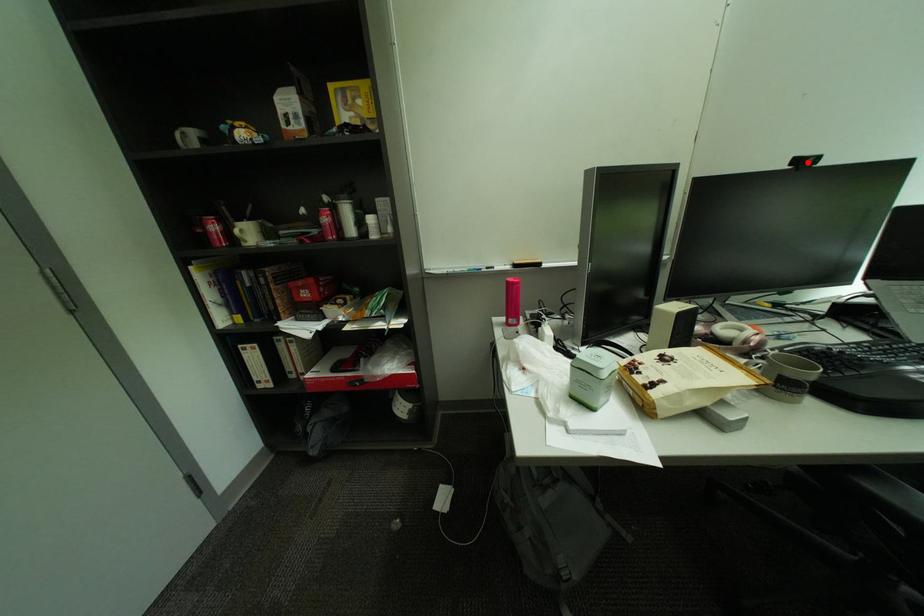
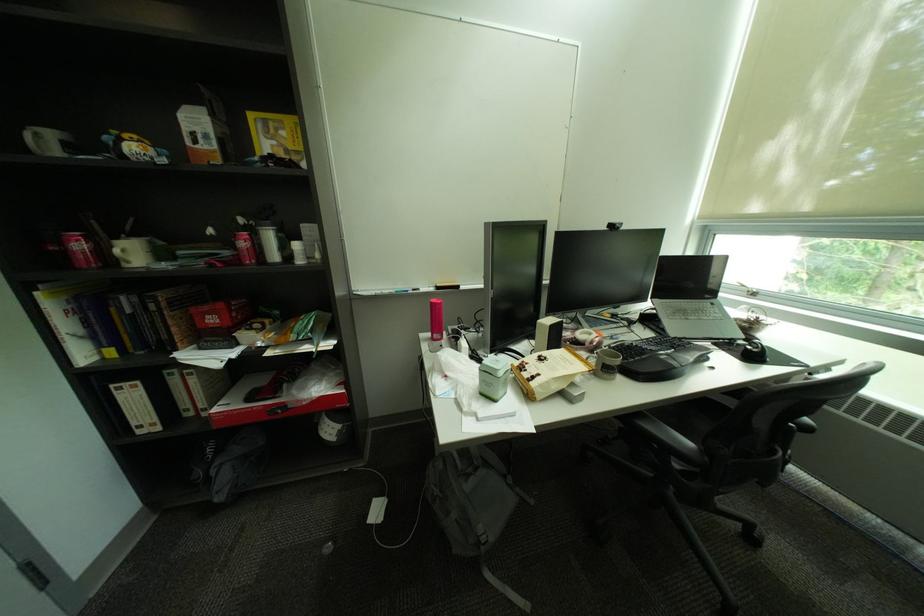
Locate, in the second image, the point that corresponds to the highlighted location in the first image.

(621, 227)